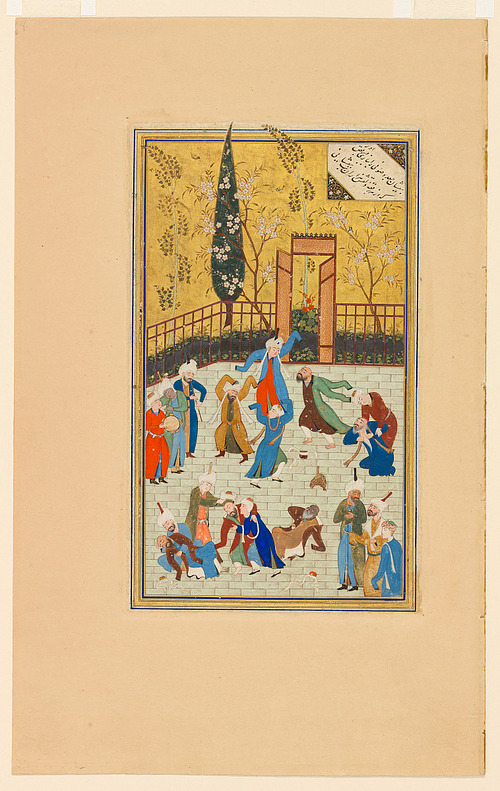
The height and width of the screenshot is (791, 500). I want to click on beige textured wall, so [x=341, y=678].